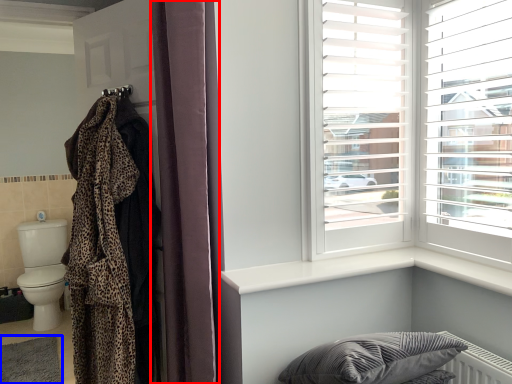
Question: Which object appears farthest to the camera in this image, curtain (highlighted by a red box) or mat (highlighted by a blue box)?

Choices:
 (A) curtain
 (B) mat

Answer: (B)